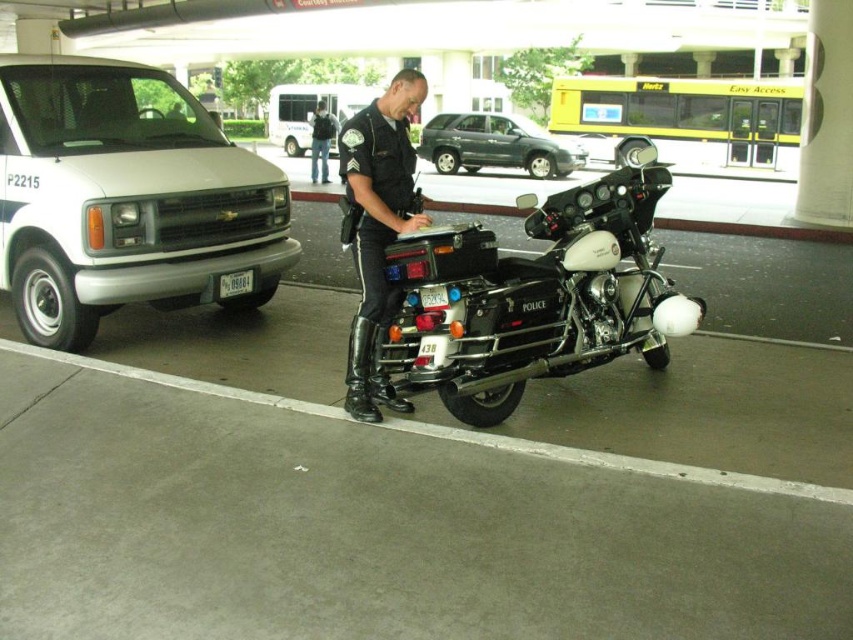
You are a pedestrian standing in the parking lot and see the shiny black police motorcycle at center and the dark blue jeans at center. Which object is closer to the ground?

The shiny black police motorcycle at center is positioned under dark blue jeans at center, so the motorcycle is closer to the ground than the jeans.

You are a photographer trying to capture both the shiny black police motorcycle at center and the dark blue jeans at center in a single frame. Which object should you focus on first to ensure both are in focus, considering their sizes?

The shiny black police motorcycle at center has a smaller size compared to dark blue jeans at center, so you should focus on the smaller motorcycle first to ensure both are in focus.